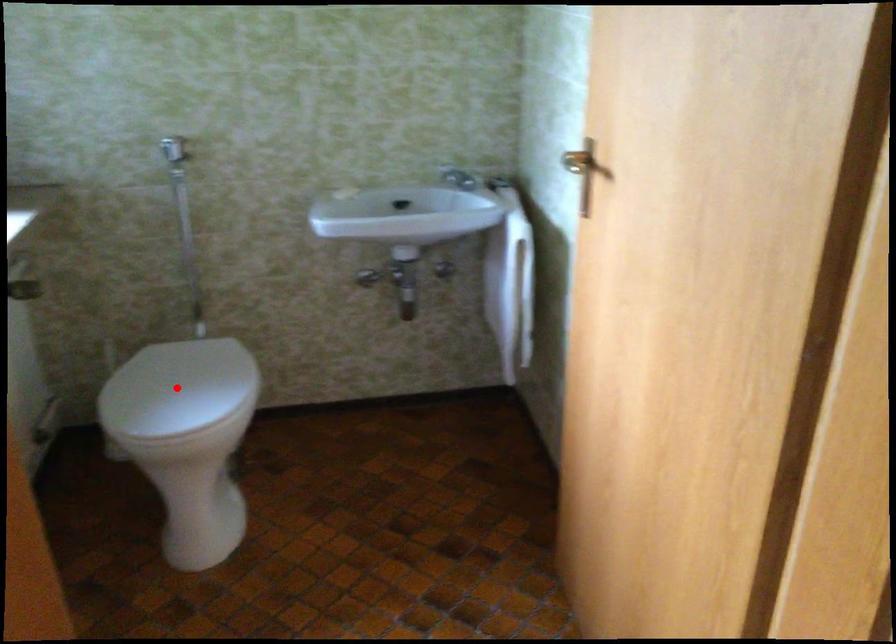
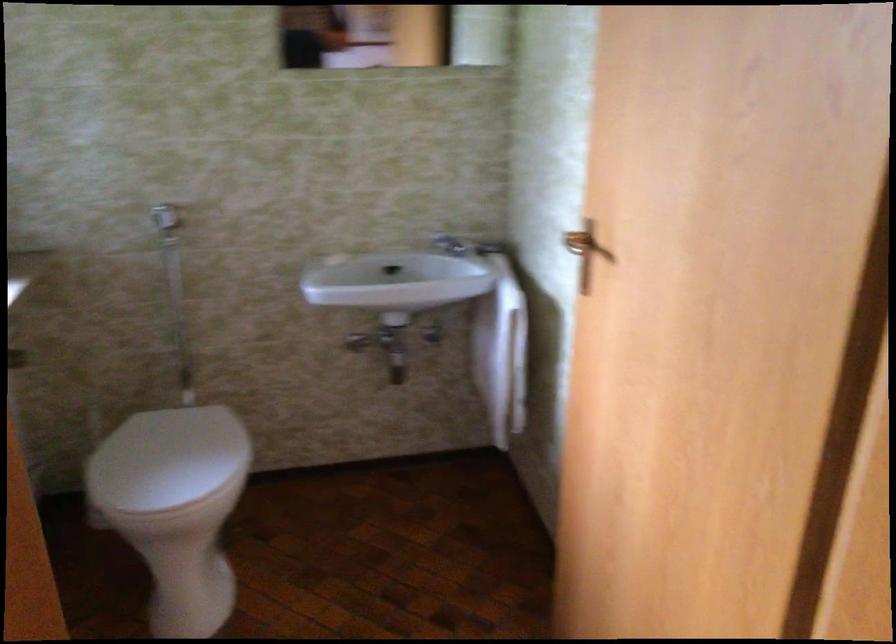
Find the pixel in the second image that matches the highlighted location in the first image.

(167, 460)